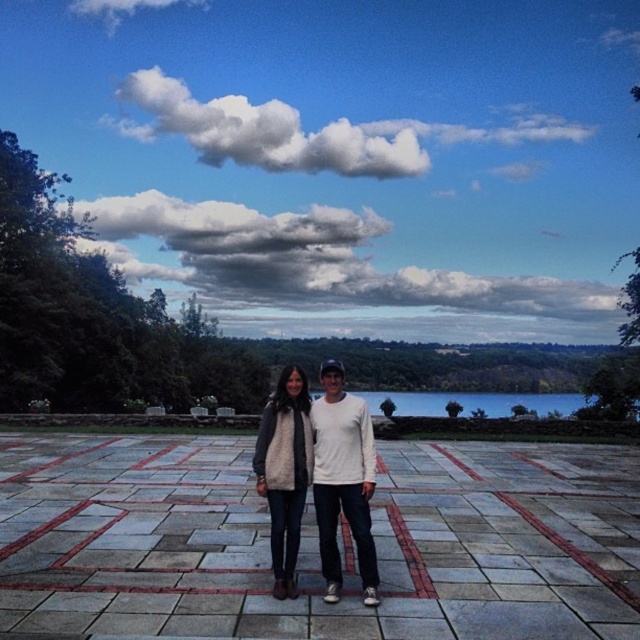
Can you confirm if cloudy sky at upper center is smaller than white fluffy cloud at upper center?

No.

Who is positioned more to the right, cloudy sky at upper center or white fluffy cloud at upper center?

Positioned to the right is white fluffy cloud at upper center.

Which is in front, point (257, 296) or point (200, 152)?

Point (257, 296)

You are a GUI agent. You are given a task and a screenshot of the screen. Output one action in this format:
    pyautogui.click(x=<x>, y=<y>)
    Task: Click on the cloudy sky at upper center
    The height and width of the screenshot is (640, 640).
    Given the screenshot: What is the action you would take?
    pyautogui.click(x=316, y=262)

Which is above, cloudy sky at upper center or fuzzy white vest at center?

cloudy sky at upper center is above.

Image resolution: width=640 pixels, height=640 pixels. I want to click on cloudy sky at upper center, so click(x=316, y=262).

Which is behind, point (301, 259) or point (280, 454)?

The point (301, 259) is behind.

At what (x,y) coordinates should I click in order to perform the action: click on cloudy sky at upper center. Please return your answer as a coordinate pair (x, y). This screenshot has width=640, height=640. Looking at the image, I should click on (316, 262).

Is cloudy sky at upper center thinner than white knit sweater at center?

In fact, cloudy sky at upper center might be wider than white knit sweater at center.

Is cloudy sky at upper center to the left of white knit sweater at center from the viewer's perspective?

Incorrect, cloudy sky at upper center is not on the left side of white knit sweater at center.

Does point (403, 266) come closer to viewer compared to point (372, 492)?

No, (403, 266) is behind (372, 492).

Identify the location of cloudy sky at upper center. (316, 262).